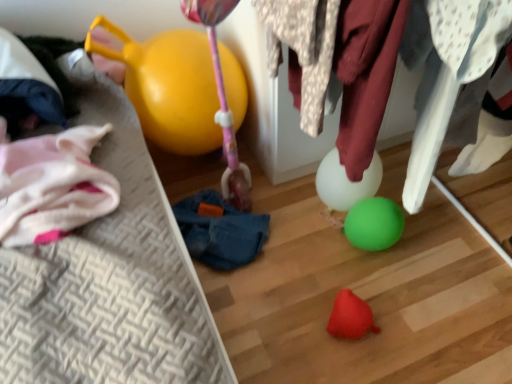
Image resolution: width=512 pixels, height=384 pixels. I want to click on free point behind rubber red toy at lower center, so click(333, 272).